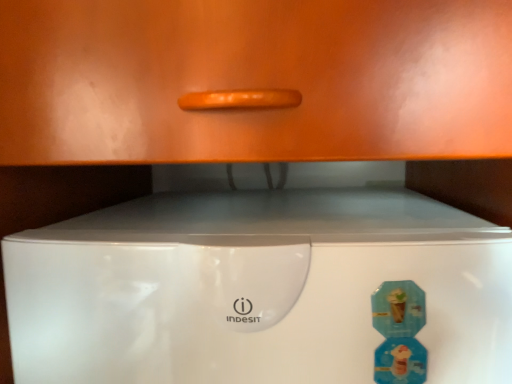
What do you see at coordinates (257, 289) in the screenshot?
I see `white glossy refrigerator at center` at bounding box center [257, 289].

In order to face white glossy refrigerator at center, should I rotate leftwards or rightwards?

Turn right by 2.615 degrees to look at white glossy refrigerator at center.

What is the approximate height of white glossy refrigerator at center?

It is 20.07 inches.

The width and height of the screenshot is (512, 384). Identify the location of white glossy refrigerator at center. (257, 289).

Where is `white glossy refrigerator at center`? Image resolution: width=512 pixels, height=384 pixels. white glossy refrigerator at center is located at coordinates (257, 289).